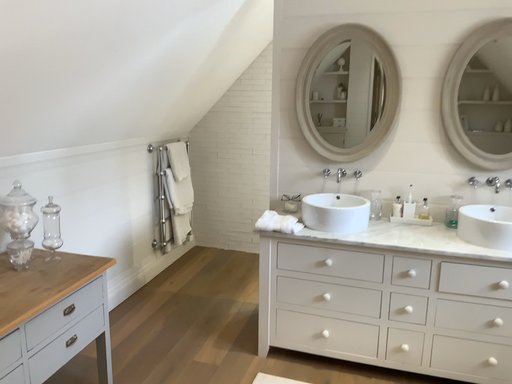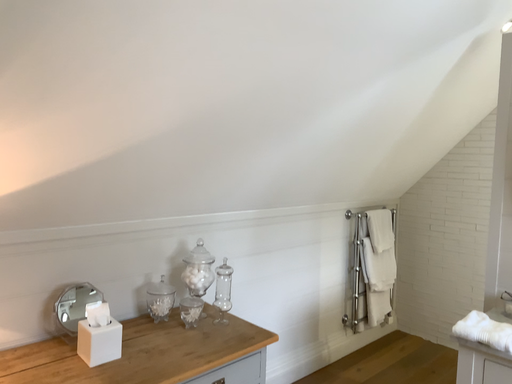
Question: How did the camera likely rotate when shooting the video?

Choices:
 (A) rotated downward
 (B) rotated upward

Answer: (B)